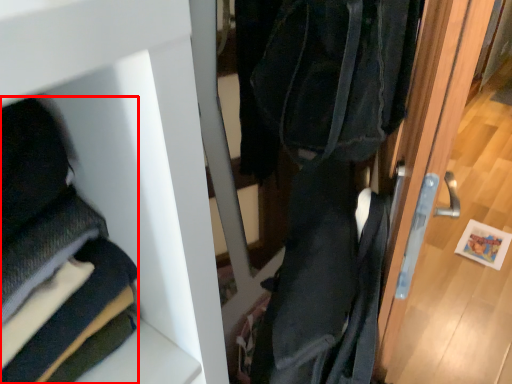
Question: From the image's perspective, what is the correct spatial positioning of cloak (annotated by the red box) in reference to door?

Choices:
 (A) above
 (B) below

Answer: (A)